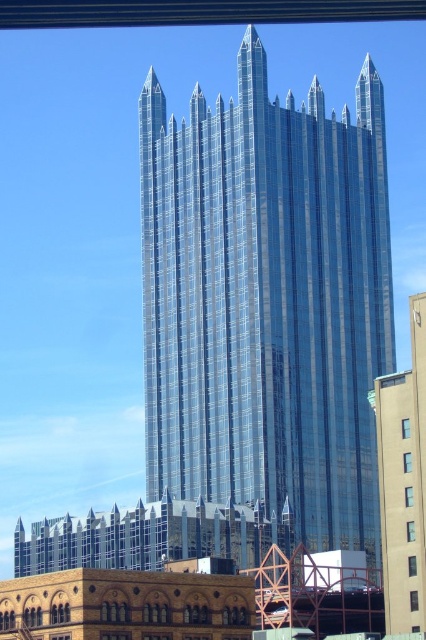
Does transparent glass tower at center have a lesser width compared to shiny glass skyscraper at center?

In fact, transparent glass tower at center might be wider than shiny glass skyscraper at center.

Is transparent glass tower at center bigger than shiny glass skyscraper at center?

Correct, transparent glass tower at center is larger in size than shiny glass skyscraper at center.

Where is `transparent glass tower at center`? This screenshot has height=640, width=426. transparent glass tower at center is located at coordinates (267, 301).

The image size is (426, 640). I want to click on transparent glass tower at center, so click(267, 301).